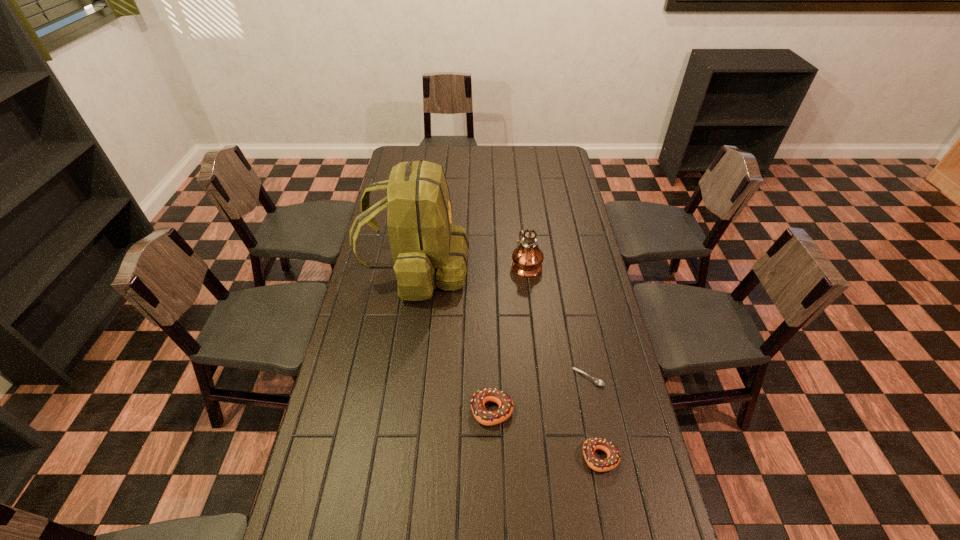
The height and width of the screenshot is (540, 960). What are the coordinates of `vacant space in between the nearer doughnut and the second tallest object` in the screenshot? It's located at (564, 360).

Locate which object ranks third in proximity to the fourth farthest object. Please provide its 2D coordinates. Your answer should be formatted as a tuple, i.e. [(x, y)], where the tuple contains the x and y coordinates of a point satisfying the conditions above.

[(428, 250)]

This screenshot has width=960, height=540. In order to click on object that stands as the second closest to the shortest object in this screenshot , I will do `click(481, 396)`.

You are a GUI agent. You are given a task and a screenshot of the screen. Output one action in this format:
    pyautogui.click(x=<x>, y=<y>)
    Task: Click on the free space that satisfies the following two spatial constraints: 1. on the back side of the shortest object; 2. on the left side of the fourth tallest object
    
    Given the screenshot: What is the action you would take?
    pyautogui.click(x=585, y=377)

Where is `free space that satisfies the following two spatial constraints: 1. on the front side of the nearest object; 2. on the left side of the third object from left to right`? Image resolution: width=960 pixels, height=540 pixels. free space that satisfies the following two spatial constraints: 1. on the front side of the nearest object; 2. on the left side of the third object from left to right is located at coordinates (547, 457).

Where is `vacant area that satisfies the following two spatial constraints: 1. on the front-facing side of the tallest object; 2. on the right side of the taller doughnut`? The width and height of the screenshot is (960, 540). vacant area that satisfies the following two spatial constraints: 1. on the front-facing side of the tallest object; 2. on the right side of the taller doughnut is located at coordinates (396, 410).

Image resolution: width=960 pixels, height=540 pixels. In order to click on free space in the image that satisfies the following two spatial constraints: 1. on the front-facing side of the soupspoon; 2. on the left side of the backpack in this screenshot , I will do `click(401, 377)`.

Find the location of a particular element. The image size is (960, 540). free space in the image that satisfies the following two spatial constraints: 1. on the front-facing side of the third shortest object; 2. on the left side of the tallest object is located at coordinates (396, 410).

Locate an element on the screen. The image size is (960, 540). vacant space that satisfies the following two spatial constraints: 1. on the front-facing side of the tallest object; 2. on the left side of the nearest object is located at coordinates (390, 457).